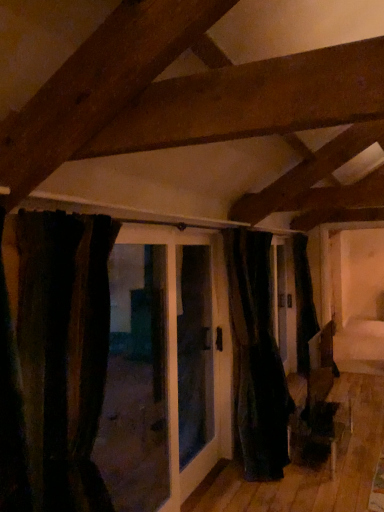
Describe the element at coordinates (165, 368) in the screenshot. The width and height of the screenshot is (384, 512). I see `black fabric door at center` at that location.

What is the approximate width of black velvet curtain at center, the second curtain from the left?

black velvet curtain at center, the second curtain from the left, is 50.69 centimeters wide.

Find the location of a particular element. Image resolution: width=384 pixels, height=512 pixels. black fabric door at center is located at coordinates (165, 368).

Is black velvet curtain at center, the second curtain from the left, not within black fabric door at center?

Yes.

Considering the relative positions of black velvet curtain at center, marked as the 1th curtain in a back-to-front arrangement, and black fabric door at center in the image provided, is black velvet curtain at center, marked as the 1th curtain in a back-to-front arrangement, to the right of black fabric door at center from the viewer's perspective?

Yes.

Is black velvet curtain at center, marked as the 1th curtain in a back-to-front arrangement, further to camera compared to black fabric door at center?

Yes, black velvet curtain at center, marked as the 1th curtain in a back-to-front arrangement, is further from the viewer.

Locate an element on the screen. door on the left of black velvet curtain at center, which is the first curtain in right-to-left order is located at coordinates (165, 368).

Considering the sizes of black fabric door at center and dark velvet curtain at left, the 2th curtain from the right, in the image, is black fabric door at center taller or shorter than dark velvet curtain at left, the 2th curtain from the right,?

→ black fabric door at center is taller than dark velvet curtain at left, the 2th curtain from the right.

From the image's perspective, between black fabric door at center and dark velvet curtain at left, which appears as the second curtain when viewed from the back, who is located below?

From the image's view, black fabric door at center is below.

Does black fabric door at center turn towards dark velvet curtain at left, which ranks as the first curtain in left-to-right order?

No.

From a real-world perspective, between black fabric door at center and dark velvet curtain at left, the 2th curtain from the right, who is vertically higher?

In real-world perspective, dark velvet curtain at left, the 2th curtain from the right, is above.

Considering the sizes of objects black velvet curtain at center, marked as the 1th curtain in a back-to-front arrangement, and dark velvet curtain at left, which is counted as the first curtain, starting from the front, in the image provided, who is wider, black velvet curtain at center, marked as the 1th curtain in a back-to-front arrangement, or dark velvet curtain at left, which is counted as the first curtain, starting from the front,?

With larger width is dark velvet curtain at left, which is counted as the first curtain, starting from the front.

Between black velvet curtain at center, which appears as the second curtain when viewed from the front, and dark velvet curtain at left, which ranks as the first curtain in left-to-right order, which one has more height?

black velvet curtain at center, which appears as the second curtain when viewed from the front, is taller.

Considering the positions of objects black velvet curtain at center, which appears as the second curtain when viewed from the front, and dark velvet curtain at left, which ranks as the first curtain in left-to-right order, in the image provided, who is more to the right, black velvet curtain at center, which appears as the second curtain when viewed from the front, or dark velvet curtain at left, which ranks as the first curtain in left-to-right order,?

Positioned to the right is black velvet curtain at center, which appears as the second curtain when viewed from the front.

Considering the sizes of dark velvet curtain at left, which ranks as the first curtain in left-to-right order, and black fabric door at center in the image, is dark velvet curtain at left, which ranks as the first curtain in left-to-right order, taller or shorter than black fabric door at center?

Considering their sizes, dark velvet curtain at left, which ranks as the first curtain in left-to-right order, has less height than black fabric door at center.

Which of these two, dark velvet curtain at left, which ranks as the first curtain in left-to-right order, or black fabric door at center, is thinner?

black fabric door at center is thinner.

Could you tell me if dark velvet curtain at left, which is counted as the first curtain, starting from the front, is facing black fabric door at center?

No, dark velvet curtain at left, which is counted as the first curtain, starting from the front, does not turn towards black fabric door at center.

Is point (49, 265) positioned behind point (121, 269)?

No.

Image resolution: width=384 pixels, height=512 pixels. I want to click on curtain above the black velvet curtain at center, which is the first curtain in right-to-left order (from the image's perspective), so click(x=64, y=352).

Considering the positions of objects dark velvet curtain at left, which appears as the second curtain when viewed from the back, and black velvet curtain at center, which is the first curtain in right-to-left order, in the image provided, who is behind, dark velvet curtain at left, which appears as the second curtain when viewed from the back, or black velvet curtain at center, which is the first curtain in right-to-left order,?

black velvet curtain at center, which is the first curtain in right-to-left order, is further from the camera.

Could black velvet curtain at center, marked as the 1th curtain in a back-to-front arrangement, be considered to be inside dark velvet curtain at left, the 2th curtain from the right?

No, dark velvet curtain at left, the 2th curtain from the right, does not contain black velvet curtain at center, marked as the 1th curtain in a back-to-front arrangement.

From the image's perspective, is dark velvet curtain at left, the 2th curtain from the right, positioned above or below black velvet curtain at center, the second curtain from the left?

dark velvet curtain at left, the 2th curtain from the right, is above black velvet curtain at center, the second curtain from the left.

Which of these two, black fabric door at center or black velvet curtain at center, the second curtain from the left, is bigger?

black velvet curtain at center, the second curtain from the left, is bigger.

Between black fabric door at center and black velvet curtain at center, which is the first curtain in right-to-left order, which one appears on the left side from the viewer's perspective?

black fabric door at center is more to the left.

Looking at this image, from the image's perspective, which is below, black fabric door at center or black velvet curtain at center, which is the first curtain in right-to-left order?

black velvet curtain at center, which is the first curtain in right-to-left order, from the image's perspective.

Locate an element on the screen. The width and height of the screenshot is (384, 512). curtain that is under the black fabric door at center (from a real-world perspective) is located at coordinates (257, 357).

You are a GUI agent. You are given a task and a screenshot of the screen. Output one action in this format:
    pyautogui.click(x=<x>, y=<y>)
    Task: Click on the curtain above the black fabric door at center (from a real-world perspective)
    The image size is (384, 512).
    Given the screenshot: What is the action you would take?
    pyautogui.click(x=64, y=352)

Which object lies further to the anchor point dark velvet curtain at left, which ranks as the first curtain in left-to-right order, black velvet curtain at center, marked as the 1th curtain in a back-to-front arrangement, or black fabric door at center?

black velvet curtain at center, marked as the 1th curtain in a back-to-front arrangement, is further to dark velvet curtain at left, which ranks as the first curtain in left-to-right order.

Estimate the real-world distances between objects in this image. Which object is further from black fabric door at center, black velvet curtain at center, the second curtain from the left, or dark velvet curtain at left, which ranks as the first curtain in left-to-right order?

dark velvet curtain at left, which ranks as the first curtain in left-to-right order, is further to black fabric door at center.

Estimate the real-world distances between objects in this image. Which object is further from black fabric door at center, dark velvet curtain at left, which is counted as the first curtain, starting from the front, or black velvet curtain at center, which appears as the second curtain when viewed from the front?

Among the two, dark velvet curtain at left, which is counted as the first curtain, starting from the front, is located further to black fabric door at center.

Which object lies nearer to the anchor point black velvet curtain at center, which is the first curtain in right-to-left order, dark velvet curtain at left, which ranks as the first curtain in left-to-right order, or black fabric door at center?

black fabric door at center is positioned closer to the anchor black velvet curtain at center, which is the first curtain in right-to-left order.

When comparing their distances from black velvet curtain at center, which appears as the second curtain when viewed from the front, does black fabric door at center or dark velvet curtain at left, which ranks as the first curtain in left-to-right order, seem further?

dark velvet curtain at left, which ranks as the first curtain in left-to-right order, is further to black velvet curtain at center, which appears as the second curtain when viewed from the front.

Considering their positions, is black fabric door at center positioned closer to dark velvet curtain at left, the 2th curtain from the right, than black velvet curtain at center, which appears as the second curtain when viewed from the front?

Based on the image, black fabric door at center appears to be nearer to dark velvet curtain at left, the 2th curtain from the right.

Image resolution: width=384 pixels, height=512 pixels. Identify the location of door between dark velvet curtain at left, the 2th curtain from the right, and black velvet curtain at center, which appears as the second curtain when viewed from the front, along the z-axis. (165, 368).